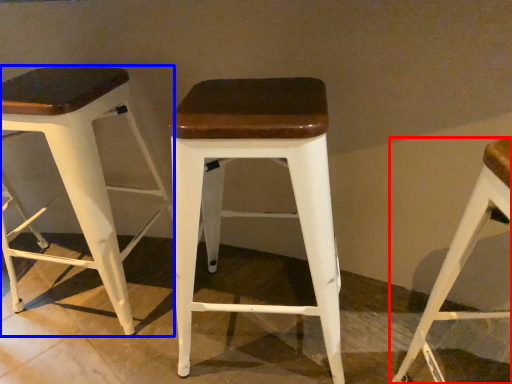
Question: Which object is closer to the camera taking this photo, stool (highlighted by a red box) or stool (highlighted by a blue box)?

Choices:
 (A) stool
 (B) stool

Answer: (A)